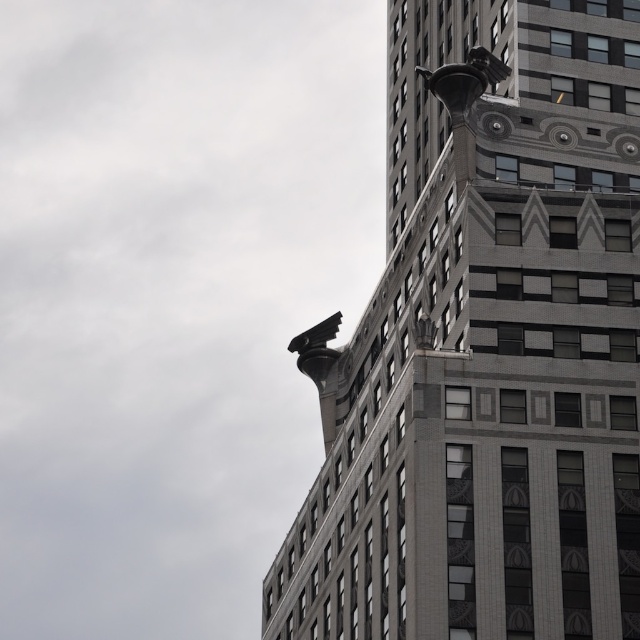
You are standing at the base of the tall building looking up. You see two points marked on the building facade. The first point is at coordinates point (x=378, y=369) and the second is at point (x=468, y=76). From your perspective, which point is closer to you?

Point (x=468, y=76) is closer to you because the point (x=378, y=369) is behind it.

Looking at this image, you are standing at the base of the building and want to touch either the gray stone eagle at upper right or the dark gray stone gargoyle at upper center. Which one can you reach first as you walk towards the building?

The gray stone eagle at upper right is closer to the viewer than the dark gray stone gargoyle at upper center, so you can reach the gray stone eagle at upper right first.